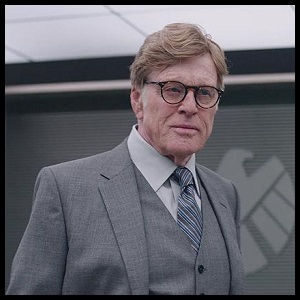
The image size is (300, 300). Identify the location of blinds. tap(63, 142).